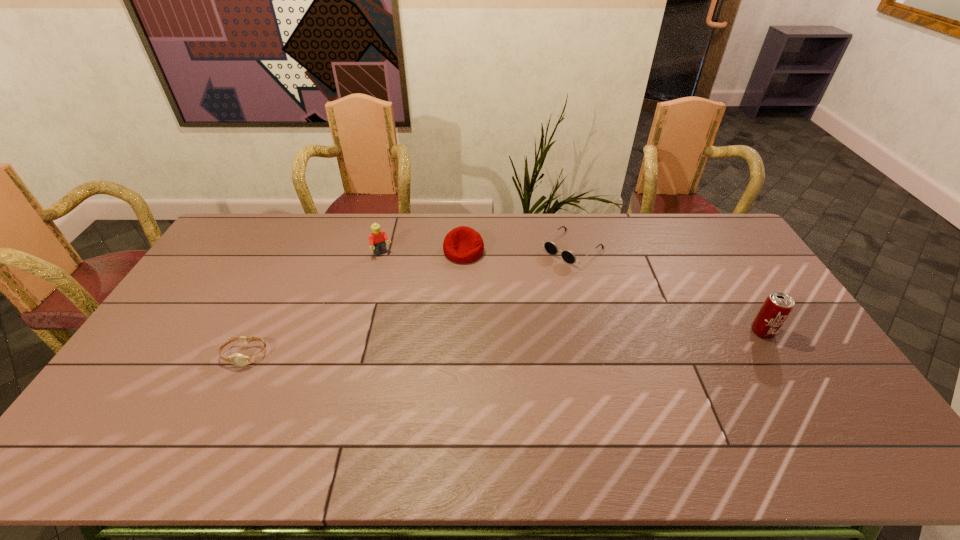
The height and width of the screenshot is (540, 960). What are the coordinates of `the leftmost object` in the screenshot? It's located at (237, 359).

This screenshot has height=540, width=960. Identify the location of the nearest object. [237, 359].

Locate an element on the screen. the rightmost object is located at coordinates (777, 307).

The image size is (960, 540). I want to click on beer can, so click(777, 307).

The width and height of the screenshot is (960, 540). I want to click on the third object from left to right, so click(463, 244).

Identify the location of beanbag. (463, 244).

You are a GUI agent. You are given a task and a screenshot of the screen. Output one action in this format:
    pyautogui.click(x=<x>, y=<y>)
    Task: Click on the sunglasses
    
    Given the screenshot: What is the action you would take?
    pyautogui.click(x=568, y=256)

The height and width of the screenshot is (540, 960). What are the coordinates of `Lego` in the screenshot? It's located at (377, 238).

Where is `free space located on the face of the watch`? The width and height of the screenshot is (960, 540). free space located on the face of the watch is located at coordinates tap(229, 386).

Find the location of `vacant space located 0.330m on the back of the beer can`. vacant space located 0.330m on the back of the beer can is located at coordinates (714, 254).